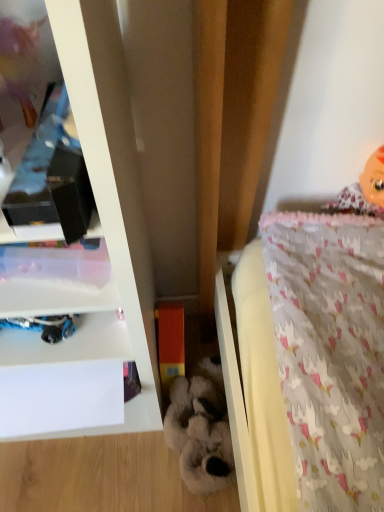
Question: Considering their positions, is pink fabric doll at upper right located in front of or behind orange matte block at center, which is the 2th toy from right to left?

Choices:
 (A) front
 (B) behind

Answer: (A)

Question: Is pink fabric doll at upper right wider or thinner than orange matte block at center, which is the 2th toy from right to left?

Choices:
 (A) wide
 (B) thin

Answer: (B)

Question: Considering the real-world distances, which object is farthest from the white glossy shelf at upper left?

Choices:
 (A) orange matte block at center, which is the 2th toy from right to left
 (B) pink fabric doll at upper right
 (C) fluffy white stuffed animal at center, which is the first toy from right to left

Answer: (B)

Question: Based on their relative distances, which object is nearer to the pink fabric doll at upper right?

Choices:
 (A) white glossy shelf at upper left
 (B) fluffy white stuffed animal at center, which is the first toy from right to left
 (C) orange matte block at center, which appears as the 1th toy when viewed from the left

Answer: (C)